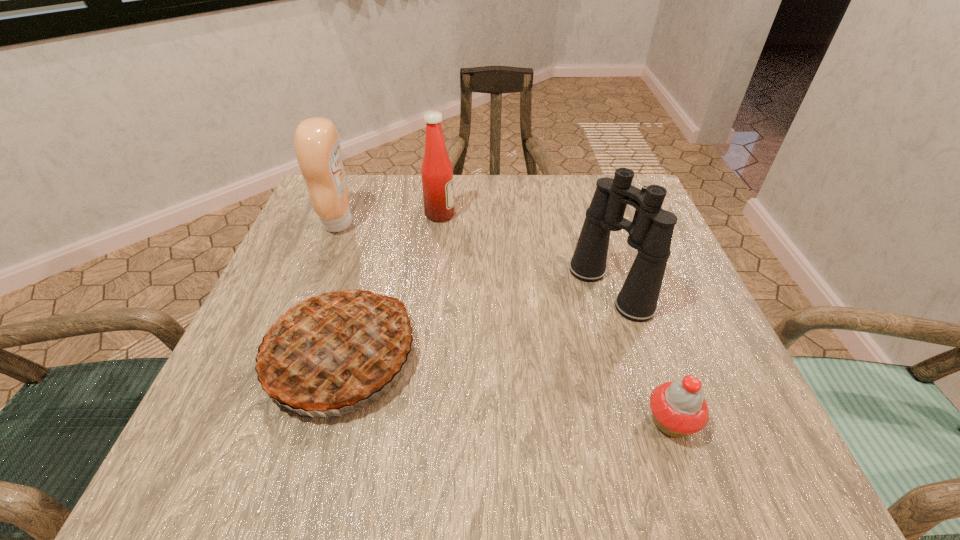
Identify the location of vacant area at the near edge. The width and height of the screenshot is (960, 540). (537, 422).

In the image, there is a desktop. Where is `blank space at the right edge`? The height and width of the screenshot is (540, 960). blank space at the right edge is located at coordinates (696, 370).

The image size is (960, 540). I want to click on free space at the far left corner, so click(x=378, y=188).

Find the location of a particular element. Image resolution: width=960 pixels, height=540 pixels. vacant space at the near left corner of the desktop is located at coordinates (193, 434).

Locate an element on the screen. The height and width of the screenshot is (540, 960). vacant space in between the left condiment and the binoculars is located at coordinates (474, 256).

Locate an element on the screen. The height and width of the screenshot is (540, 960). vacant space in between the binoculars and the cupcake is located at coordinates (x=640, y=355).

Locate an element on the screen. Image resolution: width=960 pixels, height=540 pixels. free space that is in between the binoculars and the left condiment is located at coordinates (474, 256).

This screenshot has width=960, height=540. In order to click on free space between the right condiment and the shortest object in this screenshot , I will do `click(556, 318)`.

Image resolution: width=960 pixels, height=540 pixels. Identify the location of blank region between the binoculars and the right condiment. tap(525, 252).

Locate an element on the screen. vacant region between the binoculars and the right condiment is located at coordinates (525, 252).